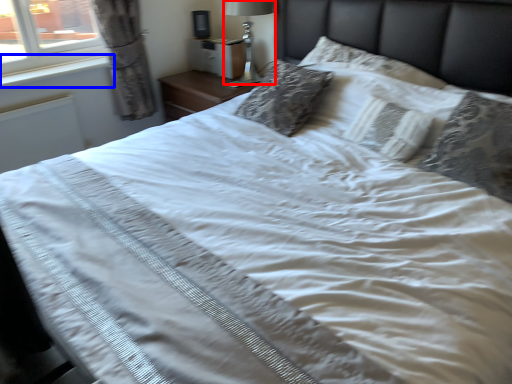
Question: Which object is further to the camera taking this photo, bedside lamp (highlighted by a red box) or window sill (highlighted by a blue box)?

Choices:
 (A) bedside lamp
 (B) window sill

Answer: (A)